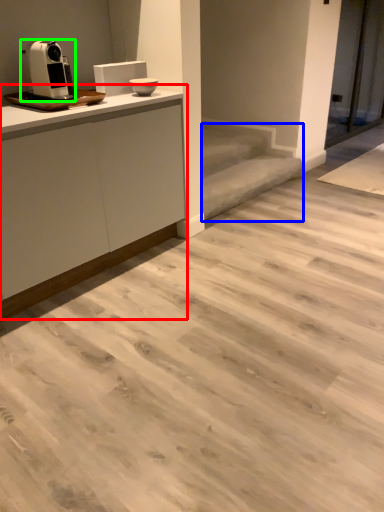
Question: Estimate the real-world distances between objects in this image. Which object is farther from cabinetry (highlighted by a red box), stair (highlighted by a blue box) or home appliance (highlighted by a green box)?

Choices:
 (A) stair
 (B) home appliance

Answer: (A)